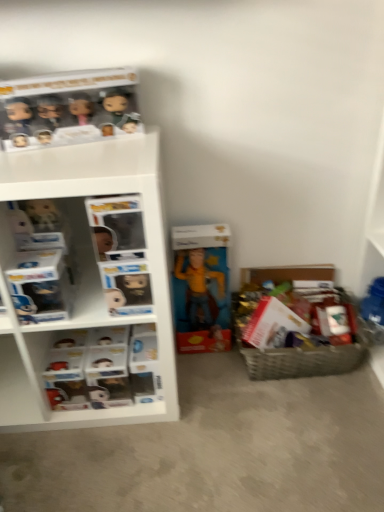
Where is `vacant space in front of woven brown basket at lower right`? The width and height of the screenshot is (384, 512). vacant space in front of woven brown basket at lower right is located at coordinates (311, 421).